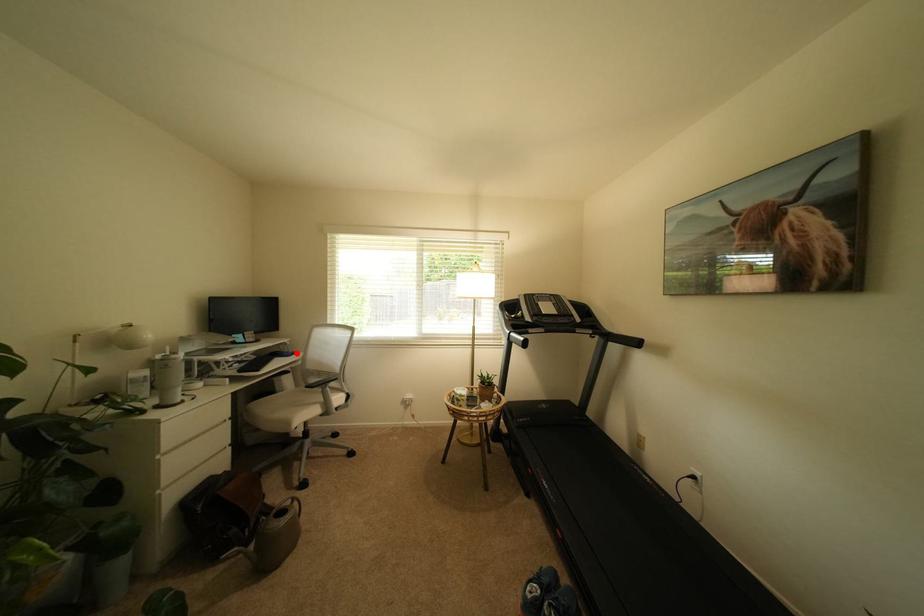
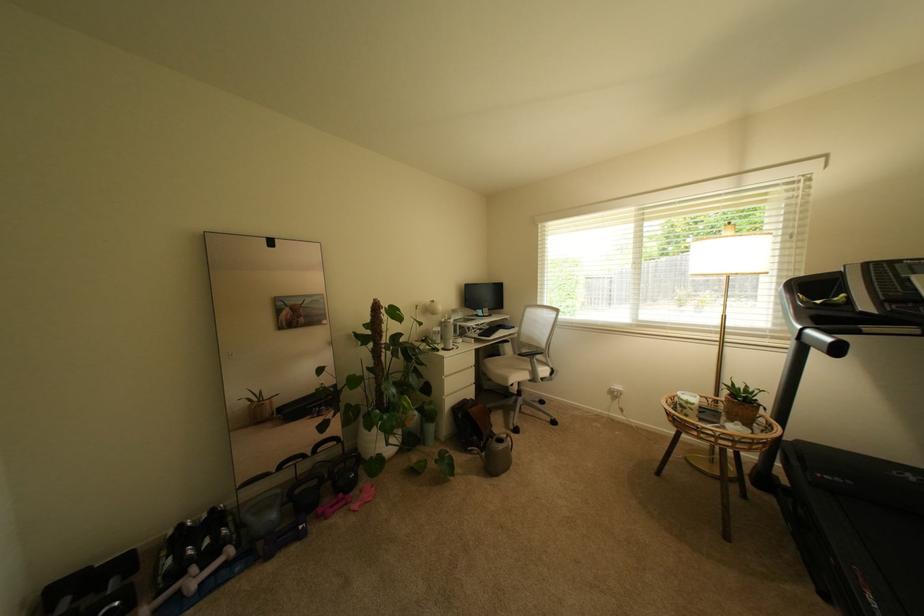
Locate, in the second image, the point that corresponds to the highlighted location in the first image.

(517, 328)